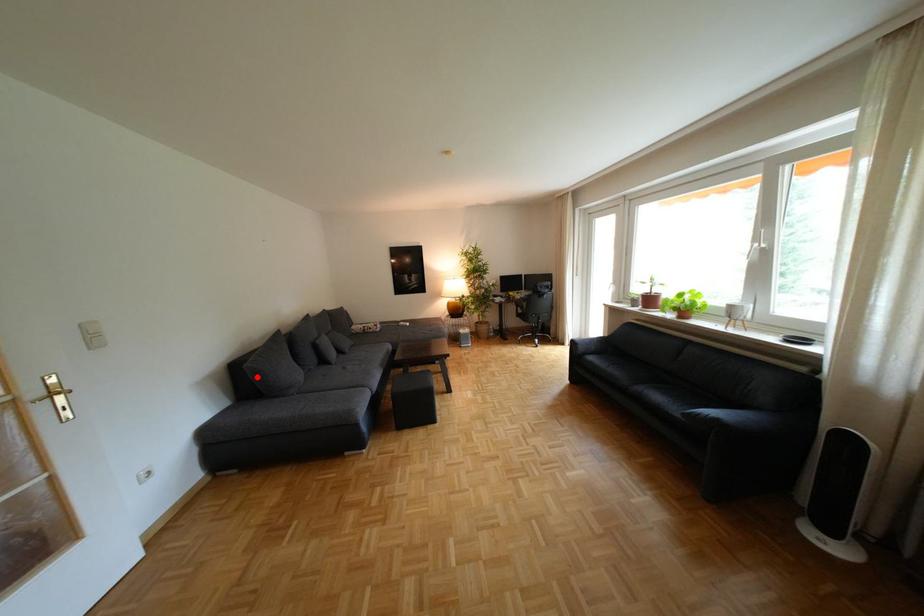
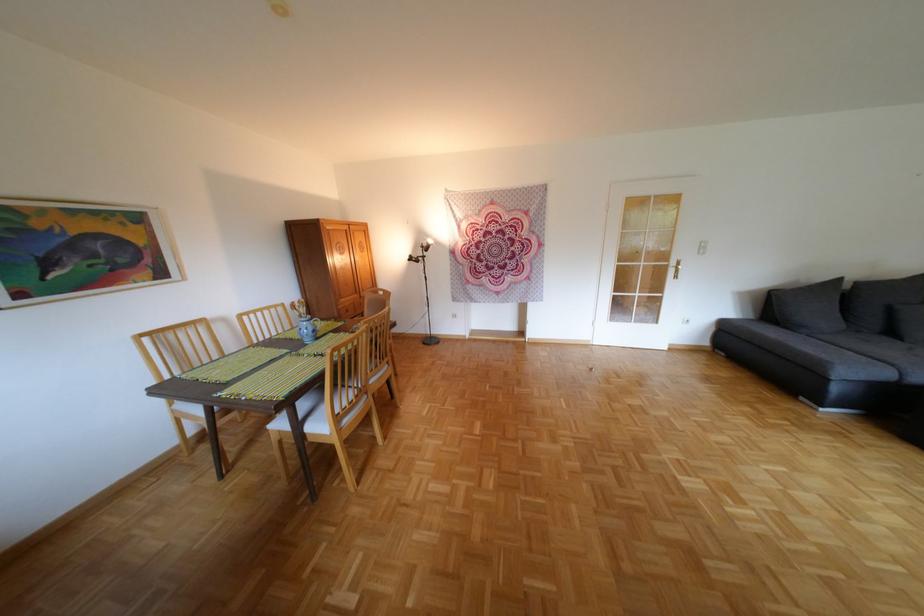
Locate, in the second image, the point that corresponds to the highlighted location in the first image.

(787, 304)